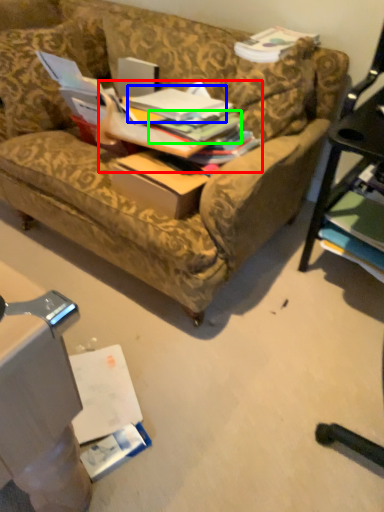
Question: Which object is the closest to the book (highlighted by a red box)? Choose among these: book (highlighted by a blue box) or book (highlighted by a green box).

Choices:
 (A) book
 (B) book

Answer: (B)